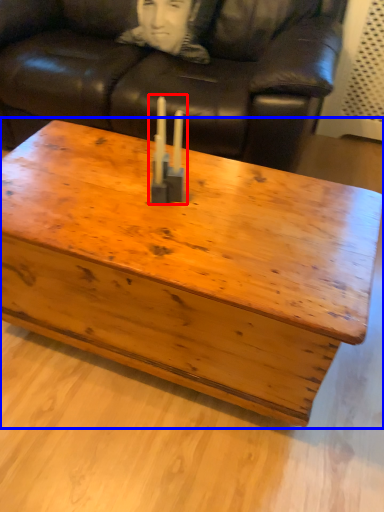
Question: Which object appears closest to the camera in this image, candle holder (highlighted by a red box) or coffee table (highlighted by a blue box)?

Choices:
 (A) candle holder
 (B) coffee table

Answer: (B)